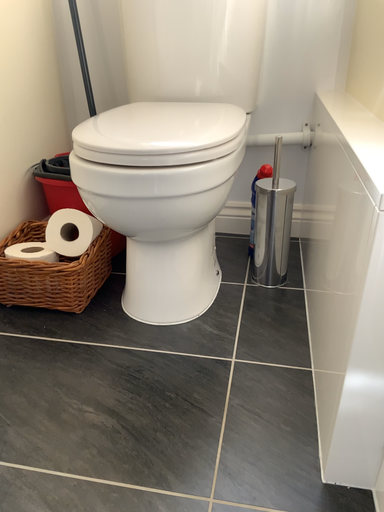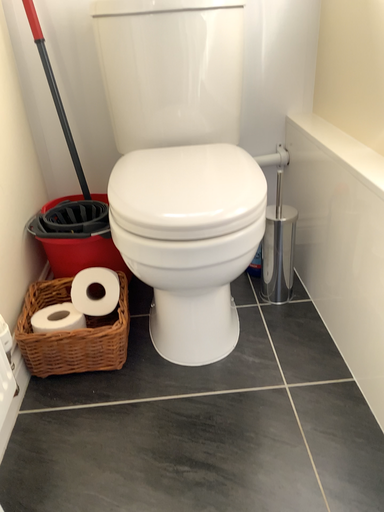
Question: How did the camera likely rotate when shooting the video?

Choices:
 (A) rotated right
 (B) rotated left

Answer: (A)